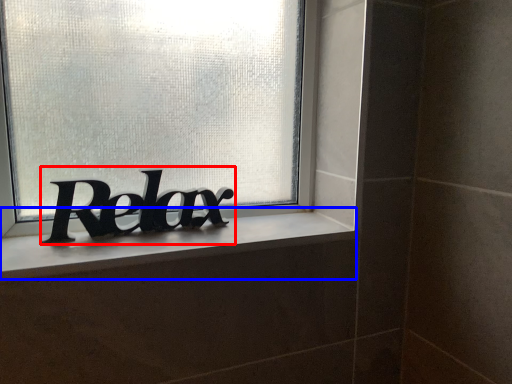
Question: Which object is closer to the camera taking this photo, lettering (highlighted by a red box) or window sill (highlighted by a blue box)?

Choices:
 (A) lettering
 (B) window sill

Answer: (B)